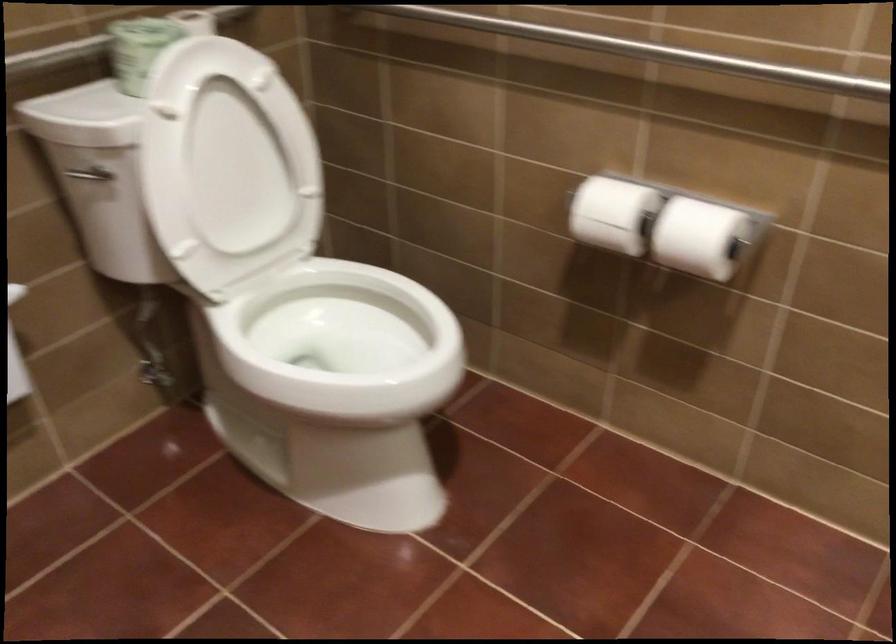
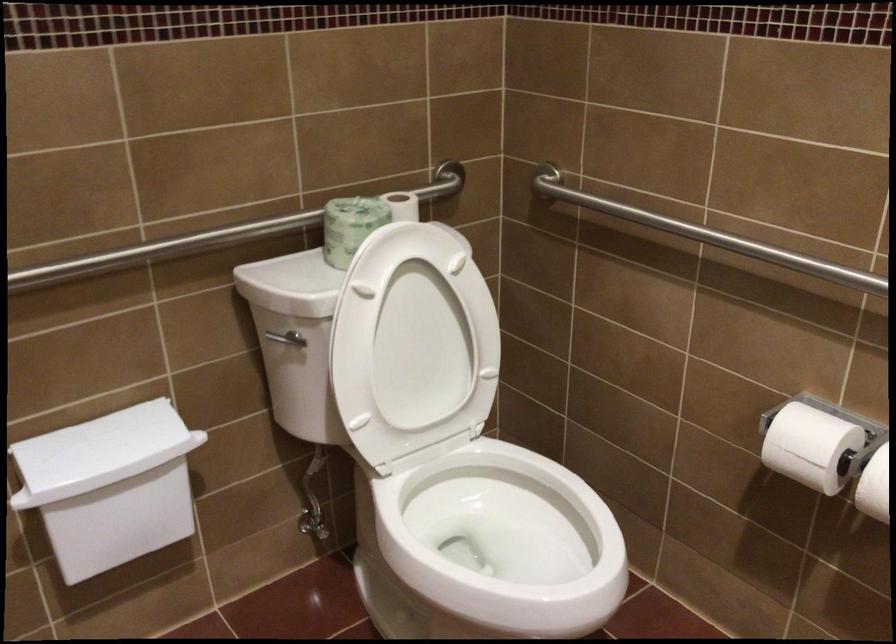
Locate, in the second image, the point that corresponds to pixel 664 237 in the first image.

(874, 486)